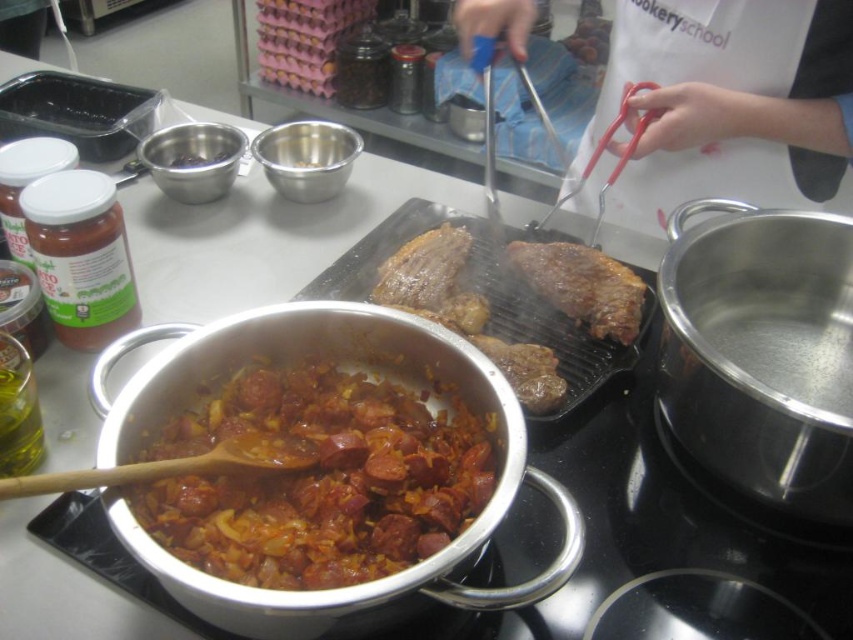
Question: Among these points, which one is nearest to the camera?

Choices:
 (A) (764, 170)
 (B) (570, 273)
 (C) (326, 444)
 (D) (213, 161)

Answer: (C)

Question: Which point appears farthest from the camera in this image?

Choices:
 (A) (294, 481)
 (B) (178, 163)
 (C) (674, 129)

Answer: (B)

Question: Does brown glossy sausages at center have a lesser width compared to blue plastic tongs at center?

Choices:
 (A) yes
 (B) no

Answer: (A)

Question: Which point is closer to the camera?

Choices:
 (A) (593, 298)
 (B) (834, 154)
 (C) (189, 164)

Answer: (B)

Question: Does blue plastic tongs at center appear over metallic bowl at upper left?

Choices:
 (A) no
 (B) yes

Answer: (B)

Question: Does blue plastic tongs at center lie behind metallic bowl at upper left?

Choices:
 (A) yes
 (B) no

Answer: (B)